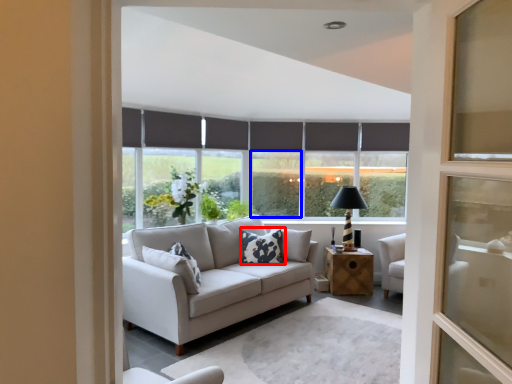
Question: Which of the following is the closest to the observer, pillow (highlighted by a red box) or window (highlighted by a blue box)?

Choices:
 (A) pillow
 (B) window

Answer: (A)